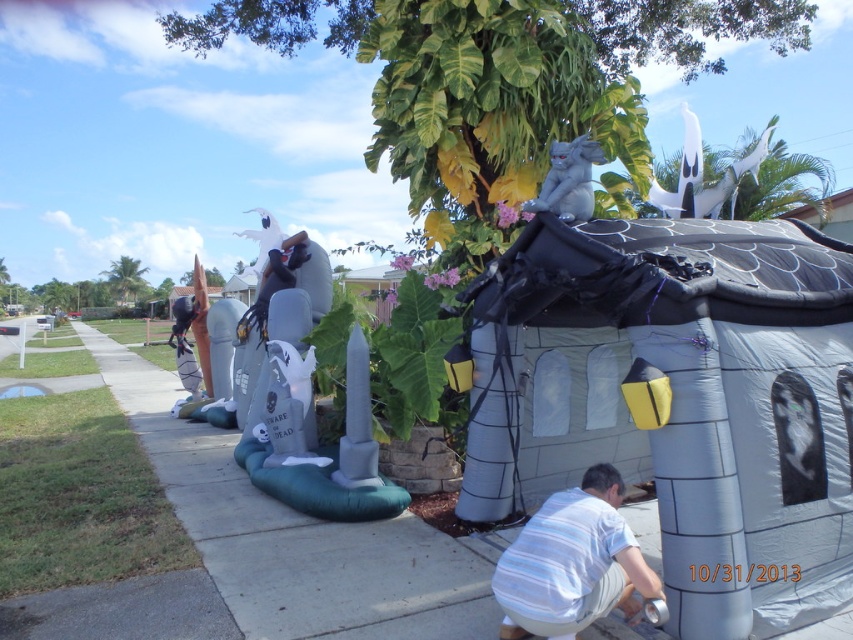
You are a delivery person who needs to place a heavy box on the gray concrete sidewalk at lower left. However, there is an inflatable gray at left nearby. Based on their positions, can you safely place the box on the sidewalk without moving the inflatable decoration?

The gray concrete sidewalk at lower left is to the left of the inflatable gray at left, meaning there is space between them. Therefore, you can safely place the box on the sidewalk without disturbing the inflatable decoration.

You are a delivery person who needs to place a large package on the gray concrete sidewalk at lower left. However, there is also a gray matte statue at upper center nearby. Which location has enough space to accommodate the package without moving the statue?

The gray concrete sidewalk at lower left has a larger size compared to the gray matte statue at upper center, so it has enough space to accommodate the package without moving the statue.

You are a delivery person who needs to place a heavy box on the gray concrete sidewalk at lower left. However, there is an inflatable gray at left nearby. Which object should you avoid placing the box on to ensure it stays stable?

You should avoid placing the box on the inflatable gray at left because it is not a solid surface like the gray concrete sidewalk at lower left.